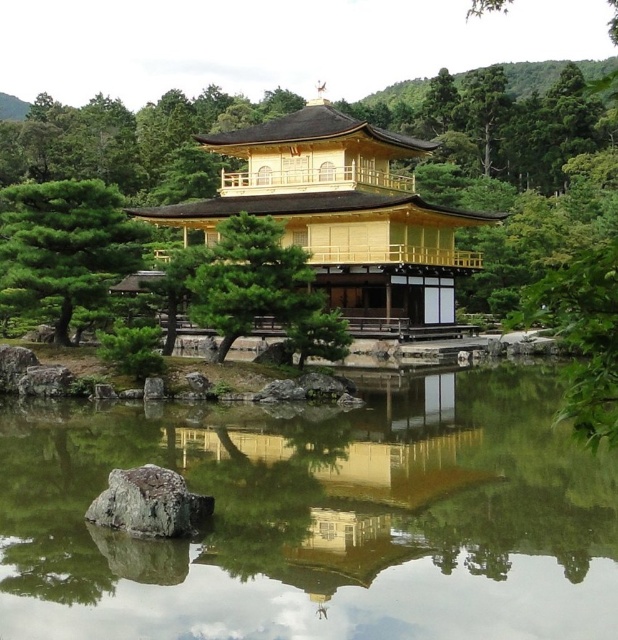
You are standing at the entrance of the Golden Pavilion and want to take a photo of the transparent glass lake at center. Where should you position yourself to capture the lake in the center of your camera frame?

To capture the transparent glass lake at center in the center of your camera frame, position yourself directly in front of the lake at point (318, 516).

You are standing at the edge of the pond in front of Kinkakuji and want to take a photo. There are two points marked in the image, point 1 at coordinates point (163, 440) and point 2 at coordinates point (99, 198). Which point is closer to you?

Point (163, 440) is closer to the camera than point (99, 198), so point 1 is closer to you.

You are a tourist visiting the Golden Pavilion and want to take a photo that includes both the golden polished wood pagoda at center and the gray rough rock at center. Which object should you position closer to the camera to ensure both are visible in the frame?

Since the golden polished wood pagoda at center is larger in size than the gray rough rock at center, you should position the gray rough rock at center closer to the camera to balance their sizes in the photo.